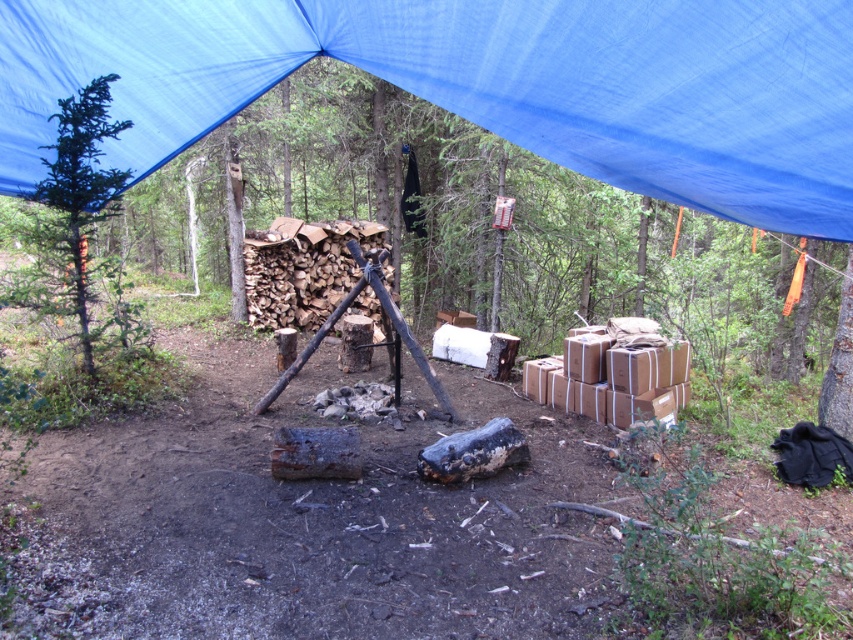
Question: Does blue fabric canopy at upper center appear on the right side of green matte tree at left?

Choices:
 (A) no
 (B) yes

Answer: (B)

Question: Is blue fabric canopy at upper center thinner than green matte tree at left?

Choices:
 (A) yes
 (B) no

Answer: (B)

Question: Is blue fabric canopy at upper center to the right of green matte tree at left from the viewer's perspective?

Choices:
 (A) no
 (B) yes

Answer: (B)

Question: Which point is farther to the camera?

Choices:
 (A) (444, 10)
 (B) (83, 179)

Answer: (B)